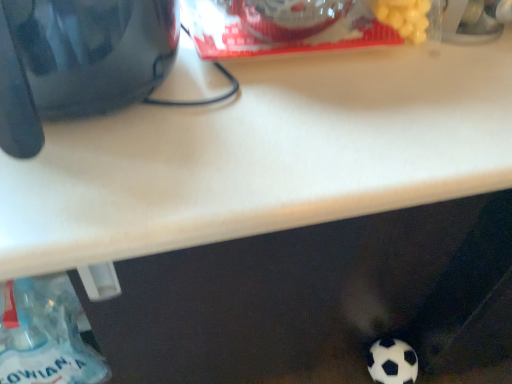
Question: From the image's perspective, is glossy black kettle at upper left on top of translucent plastic bottle at lower left?

Choices:
 (A) yes
 (B) no

Answer: (A)

Question: Can you confirm if glossy black kettle at upper left is wider than translucent plastic bottle at lower left?

Choices:
 (A) no
 (B) yes

Answer: (B)

Question: Considering the relative sizes of glossy black kettle at upper left and translucent plastic bottle at lower left in the image provided, is glossy black kettle at upper left thinner than translucent plastic bottle at lower left?

Choices:
 (A) yes
 (B) no

Answer: (B)

Question: Is glossy black kettle at upper left positioned beyond the bounds of translucent plastic bottle at lower left?

Choices:
 (A) yes
 (B) no

Answer: (A)

Question: Is glossy black kettle at upper left further to the viewer compared to translucent plastic bottle at lower left?

Choices:
 (A) no
 (B) yes

Answer: (A)

Question: Is glossy black kettle at upper left touching translucent plastic bottle at lower left?

Choices:
 (A) no
 (B) yes

Answer: (A)

Question: Does translucent plastic bottle at lower left have a greater width compared to white matte football at lower right?

Choices:
 (A) yes
 (B) no

Answer: (A)

Question: Is translucent plastic bottle at lower left at the right side of white matte football at lower right?

Choices:
 (A) yes
 (B) no

Answer: (B)

Question: Is translucent plastic bottle at lower left oriented towards white matte football at lower right?

Choices:
 (A) no
 (B) yes

Answer: (A)

Question: From the image's perspective, is translucent plastic bottle at lower left beneath white matte football at lower right?

Choices:
 (A) yes
 (B) no

Answer: (B)

Question: From the image's perspective, would you say translucent plastic bottle at lower left is positioned over white matte football at lower right?

Choices:
 (A) yes
 (B) no

Answer: (A)

Question: Is translucent plastic bottle at lower left surrounding white matte football at lower right?

Choices:
 (A) yes
 (B) no

Answer: (B)

Question: Is glossy black kettle at upper left aimed at white matte football at lower right?

Choices:
 (A) no
 (B) yes

Answer: (A)